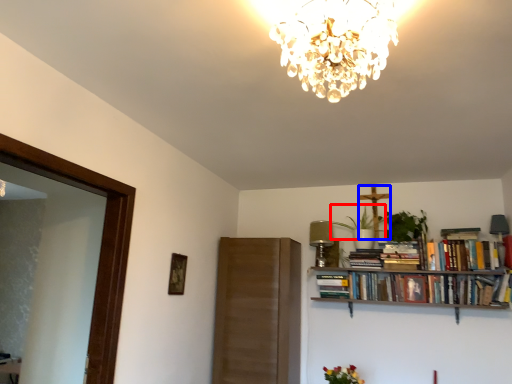
Question: Which object appears closest to the camera in this image, plant (highlighted by a red box) or crucifix (highlighted by a blue box)?

Choices:
 (A) plant
 (B) crucifix

Answer: (A)